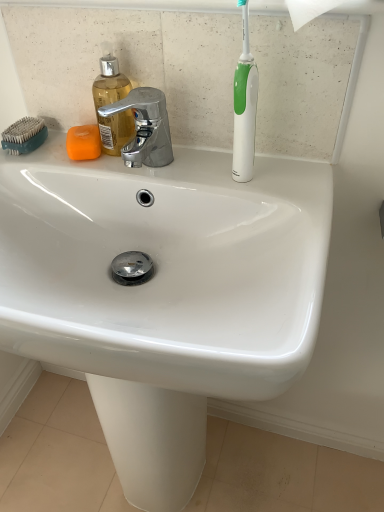
Find the location of `free location to the left of polished chrome faucet at upper center`. free location to the left of polished chrome faucet at upper center is located at coordinates 71,163.